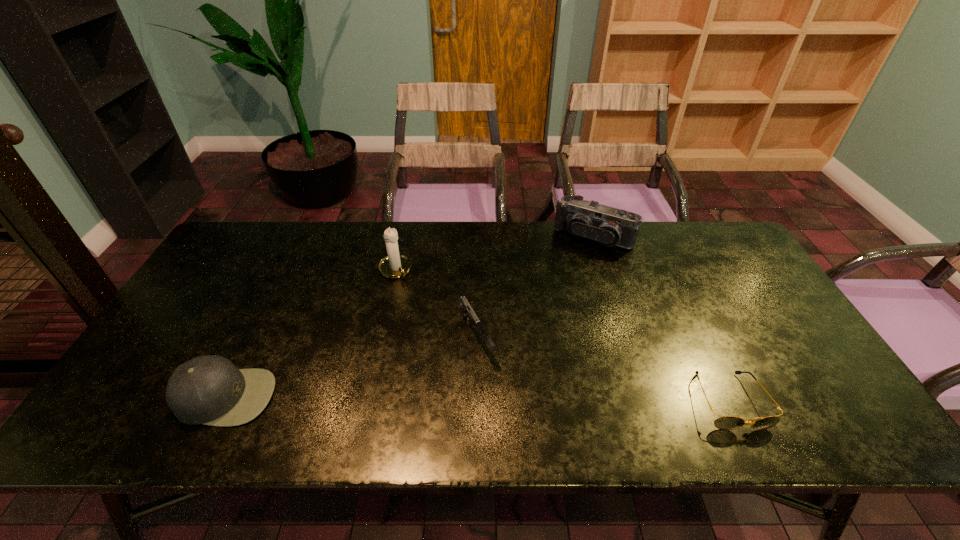
Find the location of `vacant region located on the front-facing side of the camcorder`. vacant region located on the front-facing side of the camcorder is located at coordinates (570, 262).

At what (x,y) coordinates should I click in order to perform the action: click on free space located on the front-facing side of the camcorder. Please return your answer as a coordinate pair (x, y). The image size is (960, 540). Looking at the image, I should click on (539, 312).

What are the coordinates of `vacant space situated 0.390m on the handle side of the second farthest object` in the screenshot? It's located at (468, 370).

Where is `vacant region located 0.060m on the handle side of the second farthest object`? vacant region located 0.060m on the handle side of the second farthest object is located at coordinates (411, 292).

Locate an element on the screen. This screenshot has width=960, height=540. free space located on the handle side of the second farthest object is located at coordinates (440, 331).

Where is `free spot located at the muzzle end of the gun`? free spot located at the muzzle end of the gun is located at coordinates (502, 395).

At what (x,y) coordinates should I click in order to perform the action: click on camcorder present at the far edge. Please return your answer as a coordinate pair (x, y). The image size is (960, 540). Looking at the image, I should click on (609, 226).

The width and height of the screenshot is (960, 540). I want to click on candle holder located in the far edge section of the desktop, so click(395, 265).

Where is `cap that is at the near edge`? cap that is at the near edge is located at coordinates (208, 389).

At what (x,y) coordinates should I click in order to perform the action: click on sunglasses positioned at the near edge. Please return your answer as a coordinate pair (x, y). The height and width of the screenshot is (540, 960). Looking at the image, I should click on (725, 422).